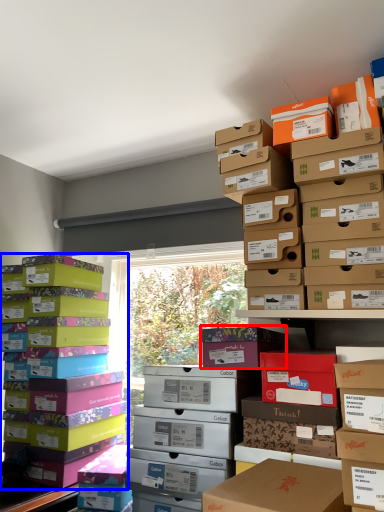
Question: Which point is further to the camera, cardboard box (highlighted by a red box) or box (highlighted by a blue box)?

Choices:
 (A) cardboard box
 (B) box

Answer: (B)